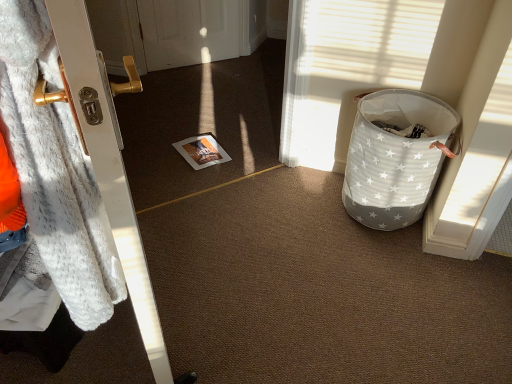
Question: Considering the relative sizes of white fur coat at left and fuzzy white blanket at left in the image provided, is white fur coat at left wider than fuzzy white blanket at left?

Choices:
 (A) no
 (B) yes

Answer: (A)

Question: Is fuzzy white blanket at left a part of white fur coat at left?

Choices:
 (A) yes
 (B) no

Answer: (B)

Question: Considering the relative positions of white fur coat at left and fuzzy white blanket at left in the image provided, is white fur coat at left to the right of fuzzy white blanket at left from the viewer's perspective?

Choices:
 (A) yes
 (B) no

Answer: (A)

Question: From the image's perspective, is white fur coat at left beneath fuzzy white blanket at left?

Choices:
 (A) yes
 (B) no

Answer: (A)

Question: Is white fur coat at left bigger than fuzzy white blanket at left?

Choices:
 (A) yes
 (B) no

Answer: (A)

Question: Is white fur coat at left facing away from fuzzy white blanket at left?

Choices:
 (A) yes
 (B) no

Answer: (A)

Question: From a real-world perspective, is white star-patterned fabric basket at right positioned under fuzzy white blanket at left based on gravity?

Choices:
 (A) no
 (B) yes

Answer: (B)

Question: Considering the relative positions of white star-patterned fabric basket at right and fuzzy white blanket at left in the image provided, is white star-patterned fabric basket at right to the right of fuzzy white blanket at left from the viewer's perspective?

Choices:
 (A) no
 (B) yes

Answer: (B)

Question: Is fuzzy white blanket at left completely or partially inside white star-patterned fabric basket at right?

Choices:
 (A) no
 (B) yes

Answer: (A)

Question: Is there a large distance between white star-patterned fabric basket at right and fuzzy white blanket at left?

Choices:
 (A) no
 (B) yes

Answer: (B)

Question: Considering the relative sizes of white star-patterned fabric basket at right and fuzzy white blanket at left in the image provided, is white star-patterned fabric basket at right thinner than fuzzy white blanket at left?

Choices:
 (A) no
 (B) yes

Answer: (A)

Question: Does white star-patterned fabric basket at right come in front of fuzzy white blanket at left?

Choices:
 (A) yes
 (B) no

Answer: (B)

Question: From a real-world perspective, is white star-patterned fabric basket at right beneath white fur coat at left?

Choices:
 (A) no
 (B) yes

Answer: (B)